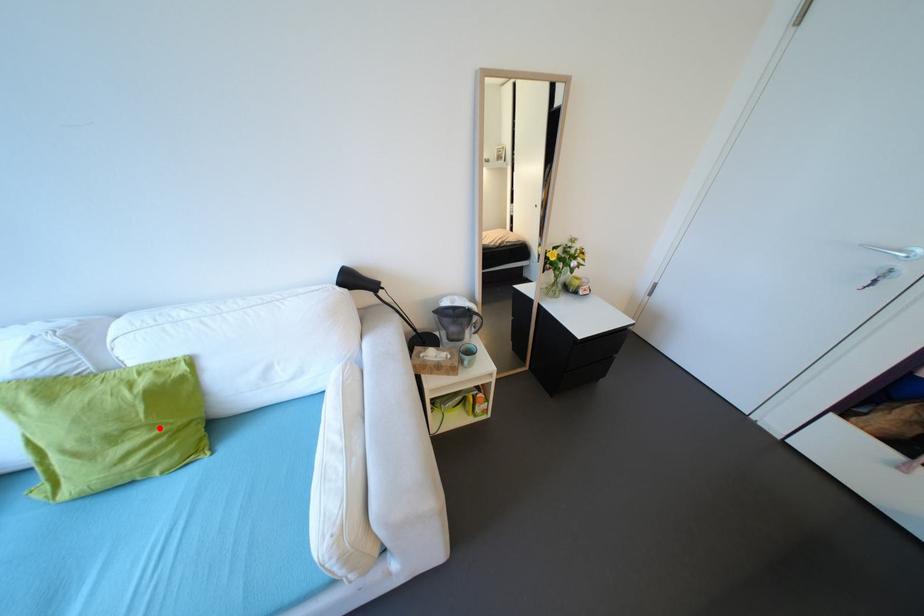
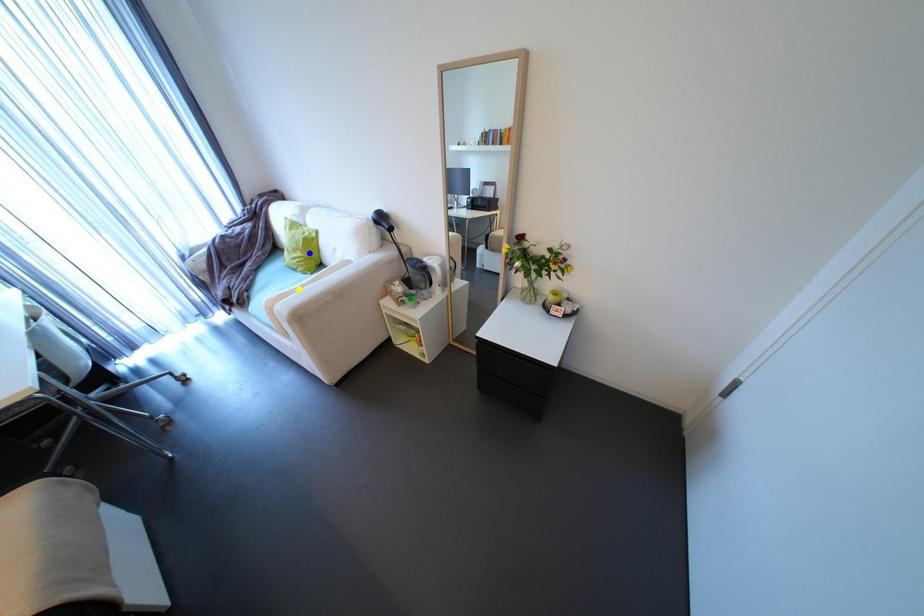
Question: I am providing you with two images of the same scene from different viewpoints. A red point is marked on the first image. You are given multiple points on the second image. Which mark in image 2 goes with the point in image 1?

Choices:
 (A) blue point
 (B) green point
 (C) yellow point

Answer: (A)